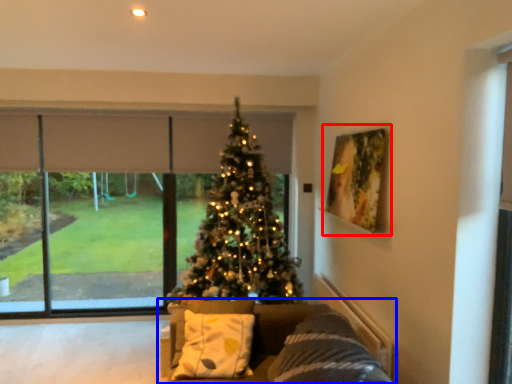
Question: Among these objects, which one is farthest to the camera, picture frame (highlighted by a red box) or studio couch (highlighted by a blue box)?

Choices:
 (A) picture frame
 (B) studio couch

Answer: (A)